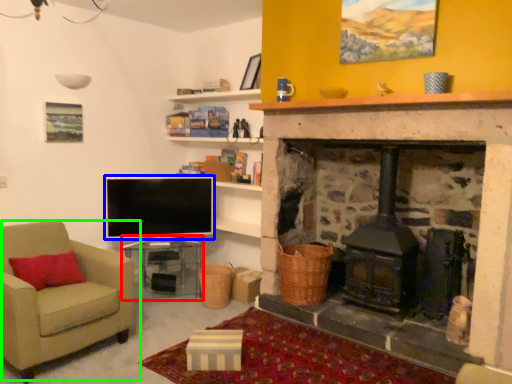
Question: Considering the real-world distances, which object is closest to table (highlighted by a red box)? television (highlighted by a blue box) or chair (highlighted by a green box).

Choices:
 (A) television
 (B) chair

Answer: (A)